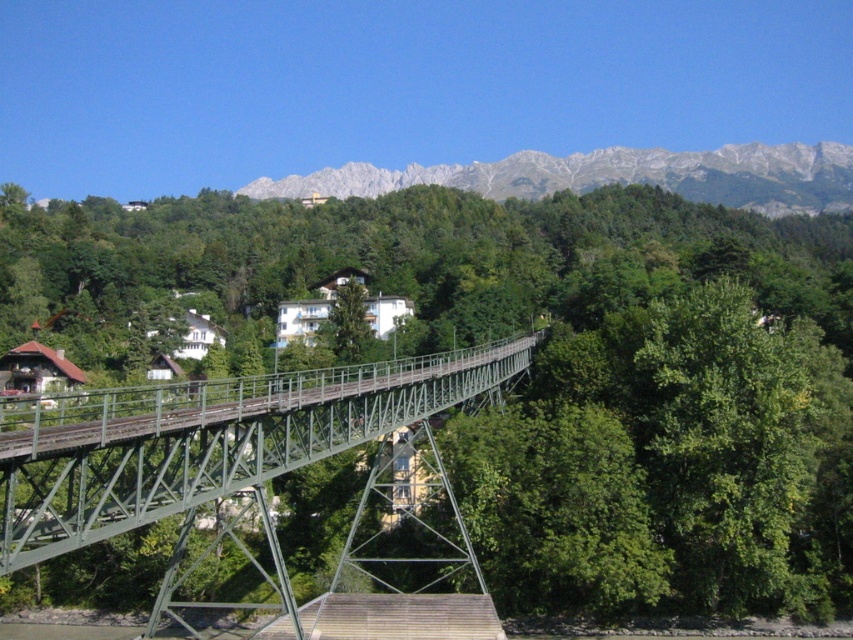
Question: Which object is closer to the camera taking this photo?

Choices:
 (A) green leafy tree at center
 (B) gray rocky mountain at upper center

Answer: (A)

Question: Which point appears closest to the camera in this image?

Choices:
 (A) (45, 481)
 (B) (404, 259)

Answer: (A)

Question: Can you confirm if green leafy tree at center is thinner than gray rocky mountain at upper center?

Choices:
 (A) yes
 (B) no

Answer: (A)

Question: In this image, where is green leafy tree at center located relative to gray rocky mountain at upper center?

Choices:
 (A) left
 (B) right

Answer: (A)

Question: Which object is closer to the camera taking this photo?

Choices:
 (A) green metallic bridge at center
 (B) green leafy tree at center
 (C) gray rocky mountain at upper center

Answer: (A)

Question: Is green leafy tree at center closer to the viewer compared to gray rocky mountain at upper center?

Choices:
 (A) no
 (B) yes

Answer: (B)